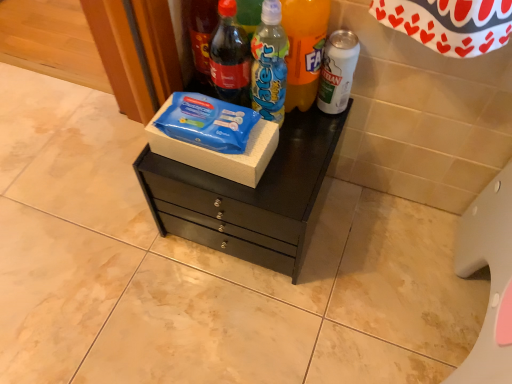
The image size is (512, 384). Find the location of `unoccupied area in front of blue plastic bottle at center, positioned as the third bottle in right-to-left order`. unoccupied area in front of blue plastic bottle at center, positioned as the third bottle in right-to-left order is located at coordinates (282, 177).